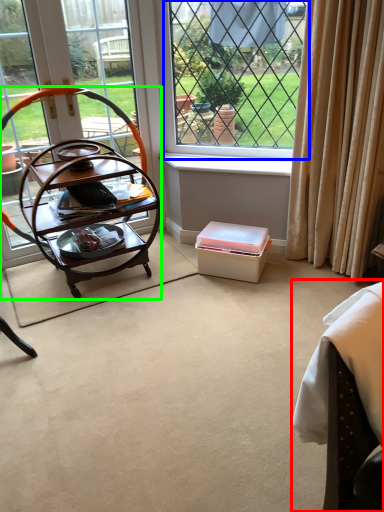
Question: Based on their relative distances, which object is farther from swivel chair (highlighted by a red box)? Choose from window (highlighted by a blue box) and desk (highlighted by a green box).

Choices:
 (A) window
 (B) desk

Answer: (A)